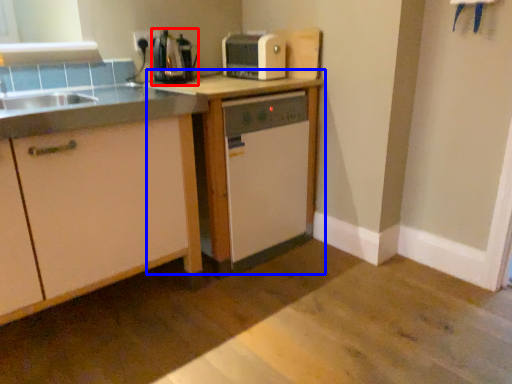
Question: Which point is closer to the camera, coffee machine (highlighted by a red box) or table (highlighted by a blue box)?

Choices:
 (A) coffee machine
 (B) table

Answer: (B)